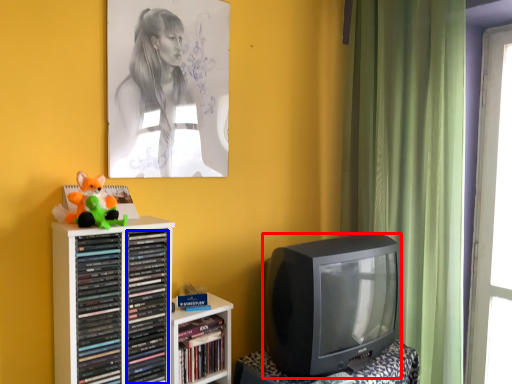
Question: Which of the following is the farthest to the observer, television (highlighted by a red box) or book (highlighted by a blue box)?

Choices:
 (A) television
 (B) book

Answer: (A)